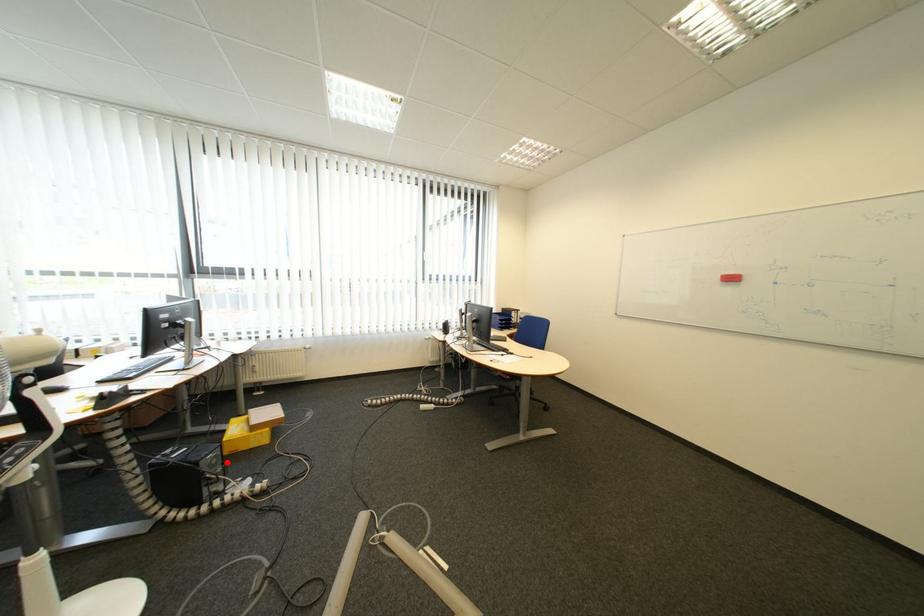
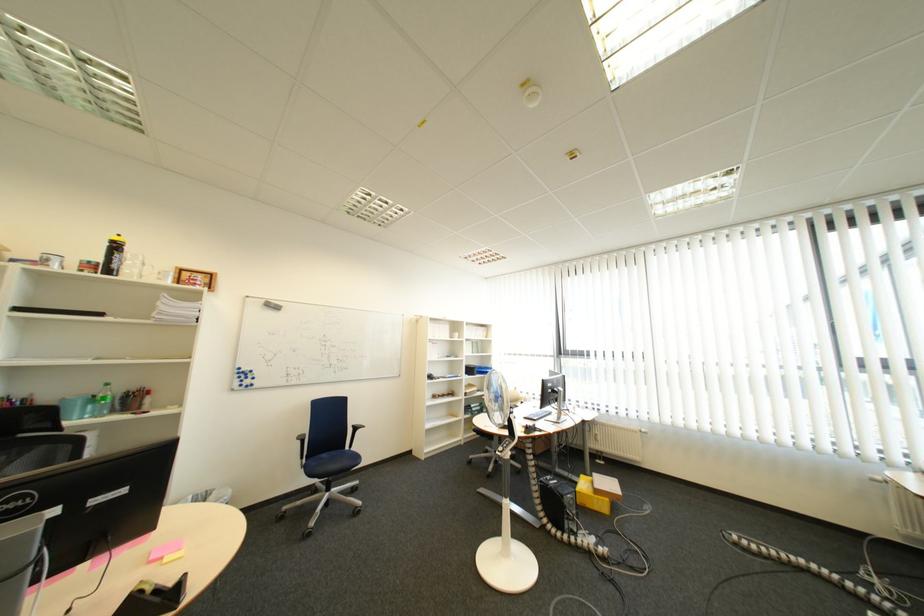
Locate, in the second image, the point that corresponds to the highlighted location in the first image.

(585, 503)